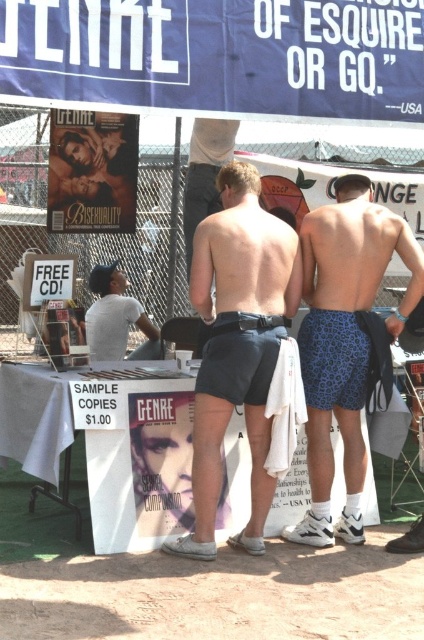
You are a photographer at the event and need to position yourself so that the blue fabric canopy at upper center and the matte black shorts at center are both clearly visible in your shot. Which object should you focus on first to ensure both are in frame?

The blue fabric canopy at upper center is bigger than the matte black shorts at center, so you should focus on the matte black shorts at center first to ensure both are in frame.

You are a photographer at the event and need to adjust the lighting so that both the blue leopard print shorts at center and the white fabric shorts at center are evenly illuminated. Based on their positions, which pair of shorts might require more light adjustment due to their width?

The blue leopard print shorts at center might require more light adjustment because they are wider than the white fabric shorts at center, so they may cast a larger shadow or need more even distribution of light.

You are a photographer at the event and need to position a light to illuminate the matte black shorts at center without casting a shadow on the blue fabric canopy at upper center. Where should you place the light?

The blue fabric canopy at upper center is above the matte black shorts at center. To avoid casting a shadow on the canopy, position the light below the shorts, facing upward.